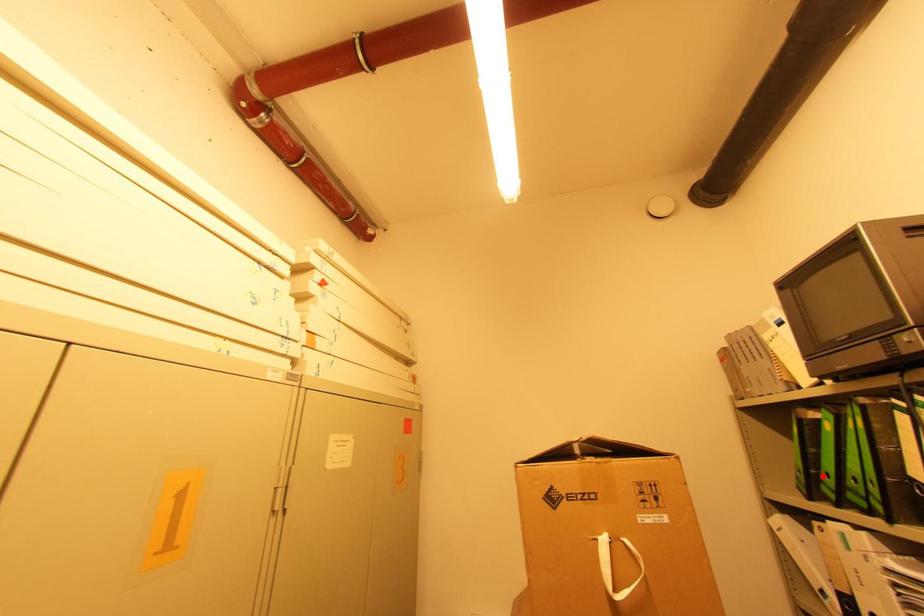
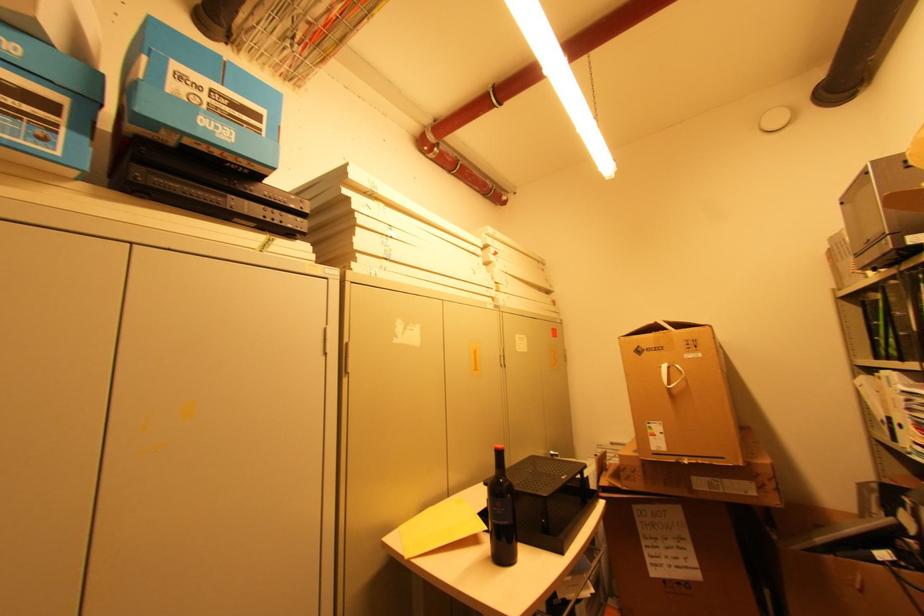
Find the pixel in the second image that matches the highlighted location in the first image.

(881, 341)